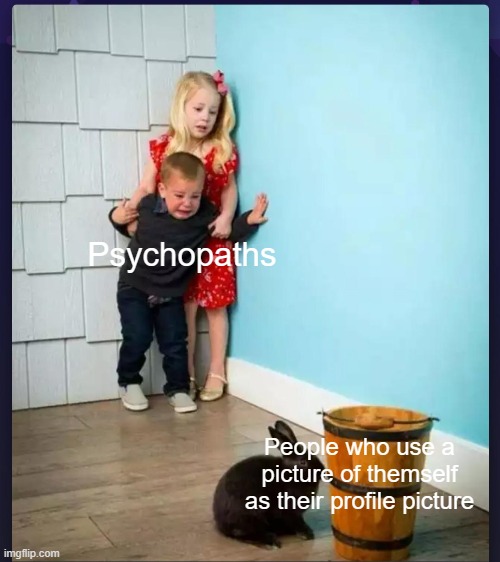
Where is `bucket`? bucket is located at coordinates (373, 487).